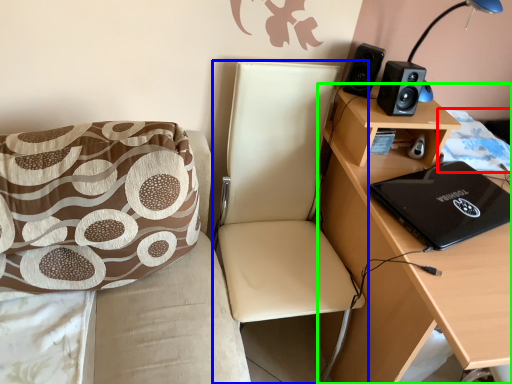
Question: Considering the real-world distances, which object is closest to quilt (highlighted by a red box)? chair (highlighted by a blue box) or desk (highlighted by a green box).

Choices:
 (A) chair
 (B) desk

Answer: (B)